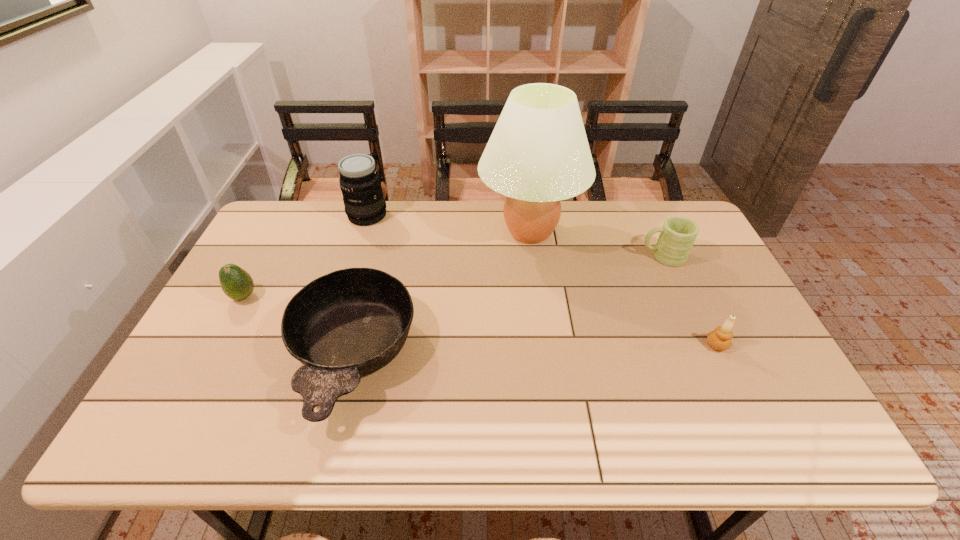
Where is `mug that is at the right edge`? The width and height of the screenshot is (960, 540). mug that is at the right edge is located at coordinates (678, 234).

I want to click on candle_holder situated at the right edge, so pos(720,339).

Image resolution: width=960 pixels, height=540 pixels. What are the coordinates of `vacant region at the far edge of the desktop` in the screenshot? It's located at (624, 201).

In the image, there is a desktop. At what (x,y) coordinates should I click in order to perform the action: click on vacant space at the near edge. Please return your answer as a coordinate pair (x, y). This screenshot has height=540, width=960. Looking at the image, I should click on (434, 436).

The height and width of the screenshot is (540, 960). Identify the location of free location at the left edge. tap(256, 269).

At what (x,y) coordinates should I click in order to perform the action: click on free spot at the right edge of the desktop. Please return your answer as a coordinate pair (x, y). The image size is (960, 540). Looking at the image, I should click on (736, 365).

The width and height of the screenshot is (960, 540). What are the coordinates of `free space between the tallest object and the mug` in the screenshot? It's located at (596, 245).

You are a GUI agent. You are given a task and a screenshot of the screen. Output one action in this format:
    pyautogui.click(x=<x>, y=<y>)
    Task: Click on the vacant area that lies between the fifth shortest object and the candle_holder
    
    Given the screenshot: What is the action you would take?
    pyautogui.click(x=542, y=280)

Identify the location of empty location between the candle_holder and the frying pan. Image resolution: width=960 pixels, height=540 pixels. (535, 351).

Image resolution: width=960 pixels, height=540 pixels. I want to click on empty location between the avocado and the tallest object, so click(387, 264).